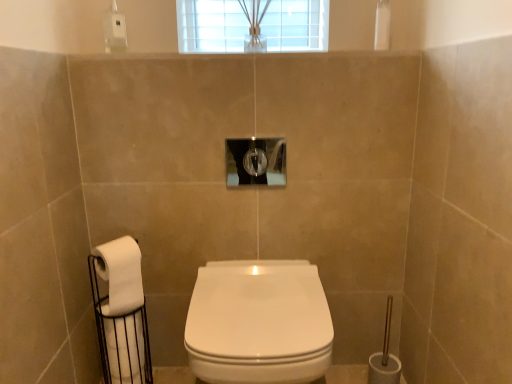
Question: Is clear glass hole at center behind white glossy toilet at center?

Choices:
 (A) no
 (B) yes

Answer: (B)

Question: Considering the relative sizes of clear glass hole at center and white glossy toilet at center in the image provided, is clear glass hole at center thinner than white glossy toilet at center?

Choices:
 (A) yes
 (B) no

Answer: (A)

Question: Is clear glass hole at center to the left of white glossy toilet at center from the viewer's perspective?

Choices:
 (A) yes
 (B) no

Answer: (A)

Question: Can you confirm if clear glass hole at center is wider than white glossy toilet at center?

Choices:
 (A) yes
 (B) no

Answer: (B)

Question: Is clear glass hole at center smaller than white glossy toilet at center?

Choices:
 (A) yes
 (B) no

Answer: (A)

Question: Is white matte toilet paper at lower left, placed as the 2th toilet paper when sorted from bottom to top, in front of or behind white matte toilet paper at left, the 2th toilet paper in the top-to-bottom sequence, in the image?

Choices:
 (A) front
 (B) behind

Answer: (A)

Question: From a real-world perspective, is white matte toilet paper at lower left, placed as the 2th toilet paper when sorted from bottom to top, physically located above or below white matte toilet paper at left, the 2th toilet paper in the top-to-bottom sequence?

Choices:
 (A) below
 (B) above

Answer: (B)

Question: From their relative heights in the image, would you say white matte toilet paper at lower left, placed as the 2th toilet paper when sorted from bottom to top, is taller or shorter than white matte toilet paper at left, the 1th toilet paper when ordered from bottom to top?

Choices:
 (A) tall
 (B) short

Answer: (B)

Question: Considering the positions of point (119, 311) and point (122, 319), is point (119, 311) closer or farther from the camera than point (122, 319)?

Choices:
 (A) farther
 (B) closer

Answer: (B)

Question: From the image's perspective, is white matte toilet paper at lower left, acting as the first toilet paper starting from the top, located above or below white glossy toilet at center?

Choices:
 (A) above
 (B) below

Answer: (A)

Question: In terms of size, does white matte toilet paper at lower left, acting as the first toilet paper starting from the top, appear bigger or smaller than white glossy toilet at center?

Choices:
 (A) small
 (B) big

Answer: (A)

Question: Considering the positions of white matte toilet paper at lower left, placed as the 2th toilet paper when sorted from bottom to top, and white glossy toilet at center in the image, is white matte toilet paper at lower left, placed as the 2th toilet paper when sorted from bottom to top, taller or shorter than white glossy toilet at center?

Choices:
 (A) tall
 (B) short

Answer: (B)

Question: From a real-world perspective, is white matte toilet paper at lower left, acting as the first toilet paper starting from the top, positioned above or below white glossy toilet at center?

Choices:
 (A) below
 (B) above

Answer: (B)

Question: From a real-world perspective, is clear glass hole at center above or below white matte toilet paper at left, the 1th toilet paper when ordered from bottom to top?

Choices:
 (A) above
 (B) below

Answer: (A)

Question: Is clear glass hole at center to the left or to the right of white matte toilet paper at left, the 1th toilet paper when ordered from bottom to top, in the image?

Choices:
 (A) left
 (B) right

Answer: (B)